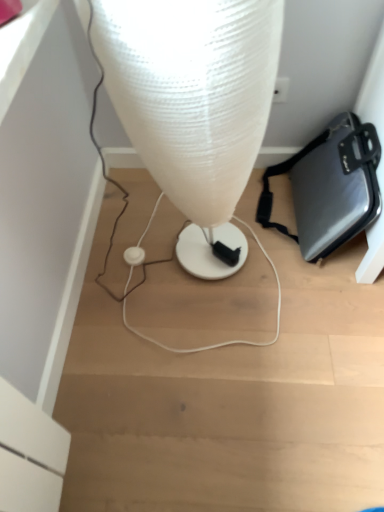
Where is `vacant area that lies in front of white plastic earphone at center`? vacant area that lies in front of white plastic earphone at center is located at coordinates (133, 303).